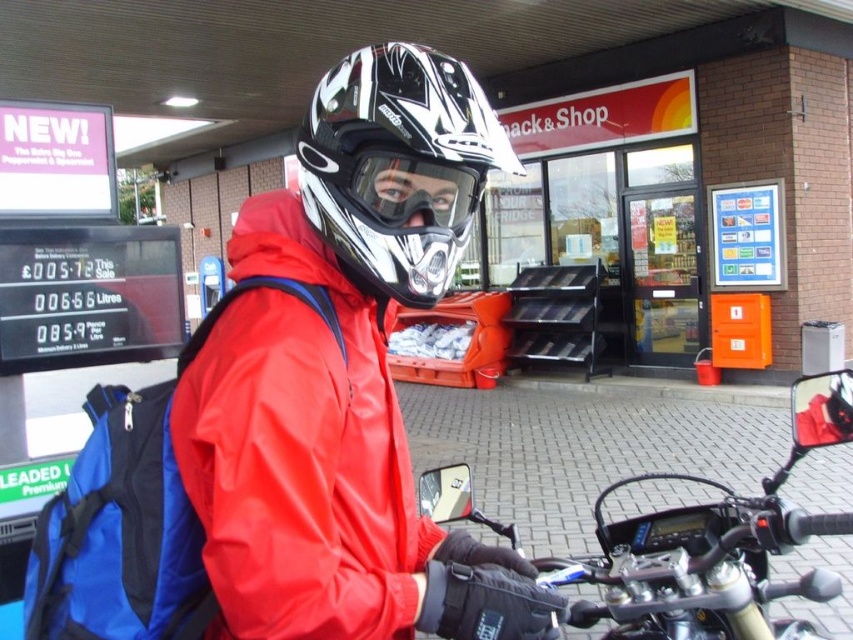
Is point (693, 561) less distant than point (457, 228)?

No, (693, 561) is further to viewer.

Does gold metallic motorcycle at center have a larger size compared to matte black goggles at center?

Indeed, gold metallic motorcycle at center has a larger size compared to matte black goggles at center.

Which is behind, point (660, 548) or point (432, 200)?

Point (660, 548)

The height and width of the screenshot is (640, 853). What are the coordinates of `gold metallic motorcycle at center` in the screenshot? It's located at (712, 547).

Looking at this image, does glossy white helmet at center appear on the left side of matte black goggles at center?

Yes, glossy white helmet at center is to the left of matte black goggles at center.

What are the coordinates of `glossy white helmet at center` in the screenshot? It's located at (398, 164).

Find the location of a particular element. glossy white helmet at center is located at coordinates (398, 164).

Is matte black helmet at center above gold metallic motorcycle at center?

Yes.

The image size is (853, 640). In order to click on matte black helmet at center in this screenshot , I will do `click(345, 376)`.

Image resolution: width=853 pixels, height=640 pixels. Find the location of `matte black helmet at center`. matte black helmet at center is located at coordinates (345, 376).

Find the location of `matte black helmet at center`. matte black helmet at center is located at coordinates (345, 376).